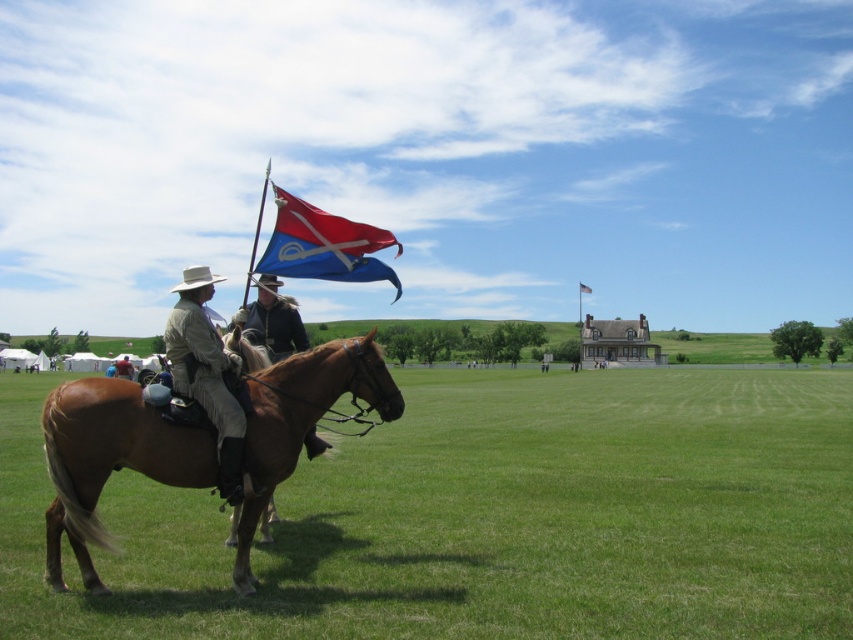
Question: Based on their relative distances, which object is nearer to the khaki fabric pants at lower left?

Choices:
 (A) light brown leather jacket at left
 (B) red fabric flag at center
 (C) dark brown leather jacket at center
 (D) brown leather horse at center

Answer: (C)

Question: Can you confirm if green grass at lower left is bigger than dark brown leather jacket at center?

Choices:
 (A) no
 (B) yes

Answer: (B)

Question: Does brown leather horse at center have a smaller size compared to red fabric flag at center?

Choices:
 (A) yes
 (B) no

Answer: (A)

Question: Does blue fabric flag at center have a greater width compared to red fabric flag at center?

Choices:
 (A) yes
 (B) no

Answer: (B)

Question: Which of these objects is positioned closest to the khaki fabric pants at lower left?

Choices:
 (A) brown leather horse at center
 (B) dark brown leather jacket at center
 (C) blue fabric flag at center
 (D) light brown leather jacket at left

Answer: (C)

Question: Which of the following is the farthest from the observer?

Choices:
 (A) (115, 369)
 (B) (276, 285)
 (C) (579, 282)

Answer: (C)